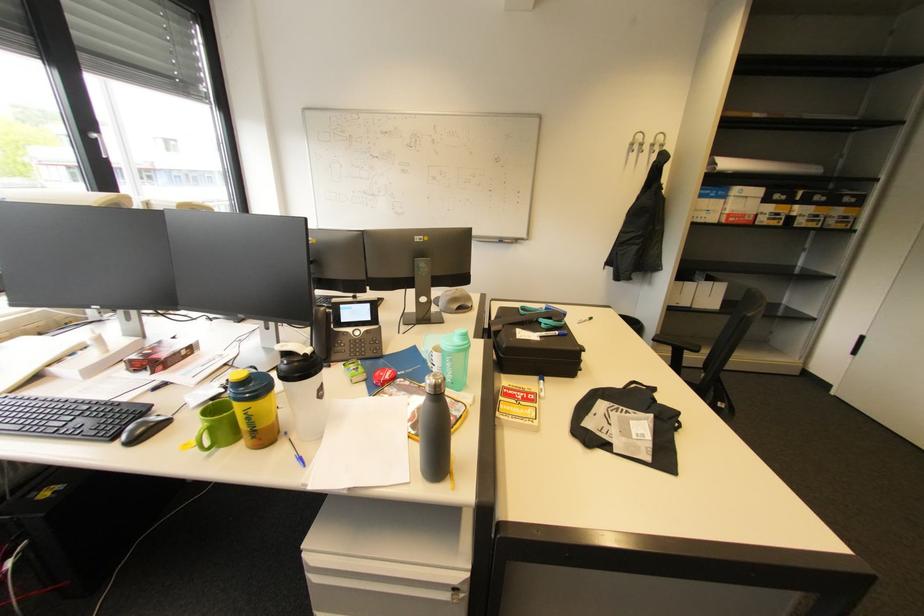
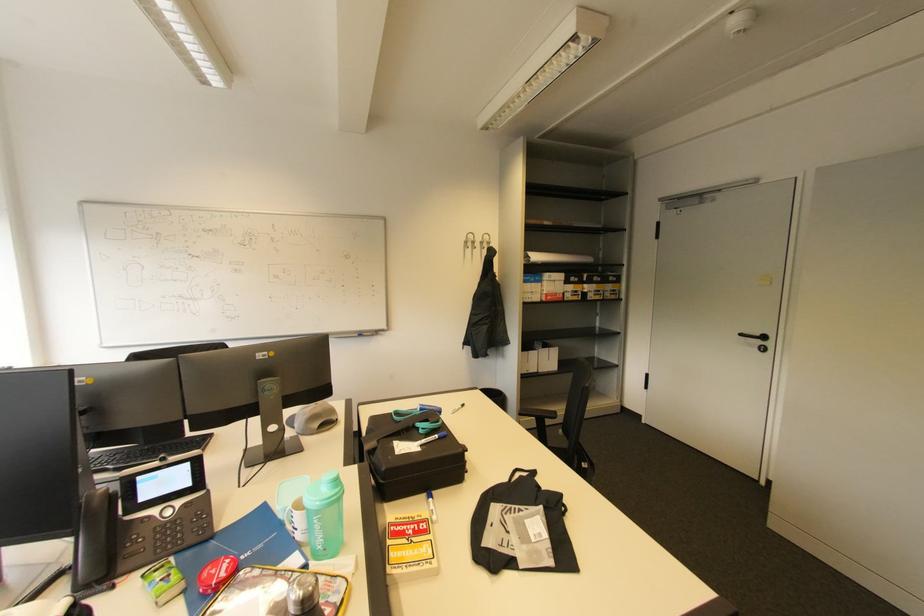
Locate, in the second image, the point that corresponds to point (439, 366) in the first image.

(300, 531)